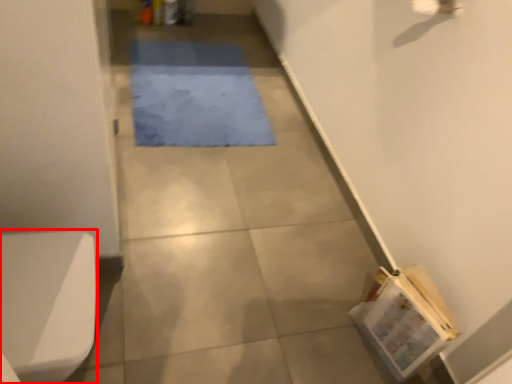
Question: From the image's perspective, what is the correct spatial relationship of toilet bowl (annotated by the red box) in relation to mat?

Choices:
 (A) below
 (B) above

Answer: (A)